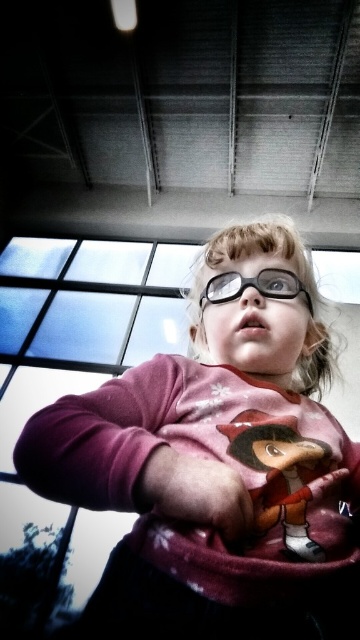
You are a photographer setting up a shot of the child in the scene. You need to ensure that the pink matte sweater at center and the matte pink plush toy at center are both in focus. Given that your camera can only focus on objects within 3 inches of each other, will both items be in focus?

The pink matte sweater at center is 3.73 inches from the matte pink plush toy at center. Since the distance between them exceeds the camera focus range of 3 inches, the camera cannot keep both items in focus simultaneously.

You are a photographer trying to capture the child in the scene. You notice the pink matte hand at center and the black plastic glasses at center. Which object would require a closer focus to ensure clarity in the photo?

The pink matte hand at center has a lesser width compared to the black plastic glasses at center, so it would require closer focus to ensure clarity in the photo.

You are a photographer adjusting your camera settings to focus on the pink matte sweater at center and the pink matte hand at center. Which object should you focus on first to ensure both are in sharp focus?

You should focus on the pink matte sweater at center first because it is closer to the viewer than the pink matte hand at center, allowing the depth of field to cover both objects effectively.